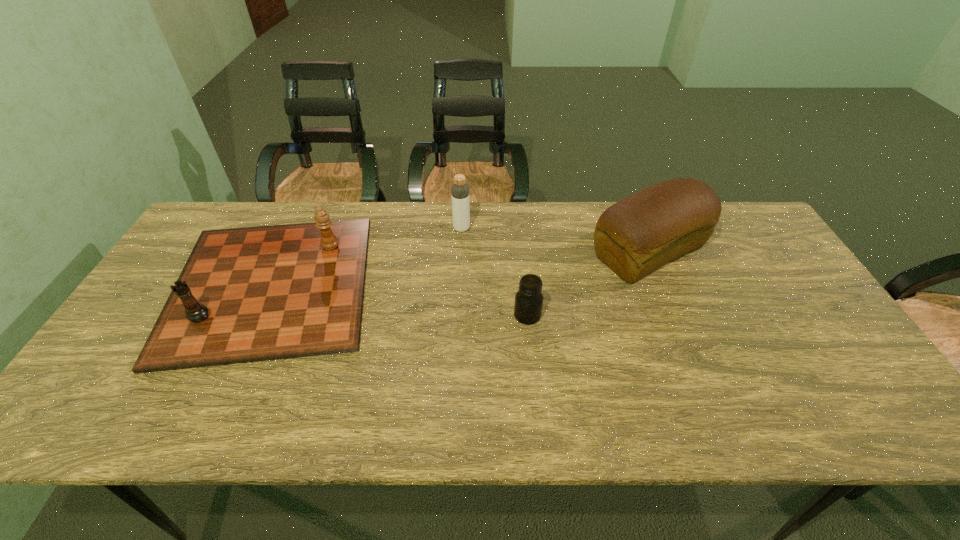
Where is `the rightmost object`? The height and width of the screenshot is (540, 960). the rightmost object is located at coordinates (637, 235).

Where is `bottle`? bottle is located at coordinates (459, 191).

At what (x,y) coordinates should I click in order to perform the action: click on the second shortest object. Please return your answer as a coordinate pair (x, y). The image size is (960, 540). Looking at the image, I should click on (251, 294).

You are a GUI agent. You are given a task and a screenshot of the screen. Output one action in this format:
    pyautogui.click(x=<x>, y=<y>)
    Task: Click on the gameboard
    The height and width of the screenshot is (540, 960).
    Given the screenshot: What is the action you would take?
    pyautogui.click(x=251, y=294)

Where is `the second object from right to left`? This screenshot has height=540, width=960. the second object from right to left is located at coordinates (528, 305).

At what (x,y) coordinates should I click in order to perform the action: click on jar. Please return your answer as a coordinate pair (x, y). The width and height of the screenshot is (960, 540). Looking at the image, I should click on (528, 305).

Where is `free spot located 0.070m on the back of the rightmost object`? Image resolution: width=960 pixels, height=540 pixels. free spot located 0.070m on the back of the rightmost object is located at coordinates (630, 207).

Locate an element on the screen. Image resolution: width=960 pixels, height=540 pixels. vacant space positioned 0.390m on the left of the bottle is located at coordinates (332, 228).

Identify the location of vacant space situated on the left of the third object from left to right. (494, 315).

This screenshot has height=540, width=960. Find the location of `bread that is at the far edge`. bread that is at the far edge is located at coordinates (637, 235).